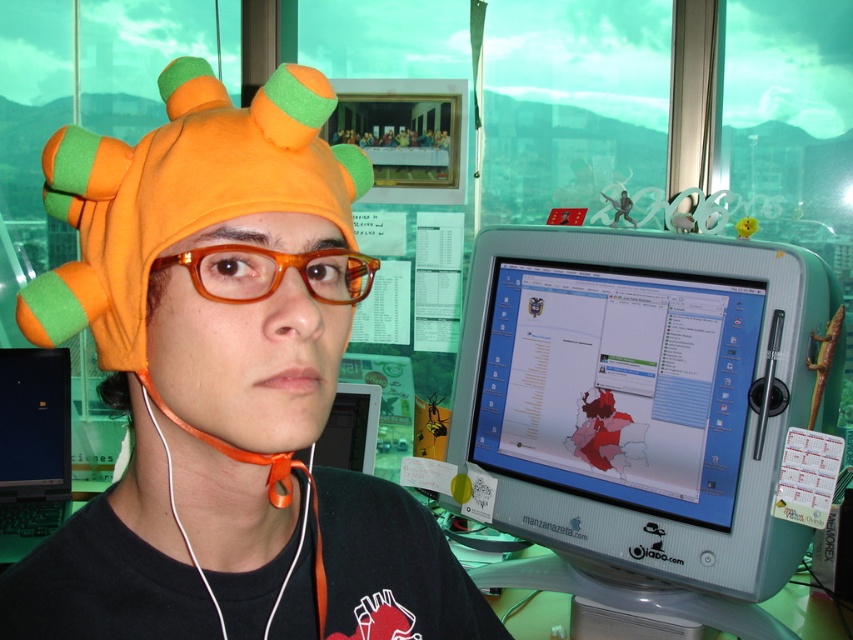
Does orange fleece hat at center have a larger size compared to white earphone at lower left?

Yes.

Does orange fleece hat at center appear on the left side of white earphone at lower left?

Correct, you'll find orange fleece hat at center to the left of white earphone at lower left.

Identify the location of orange fleece hat at center. The width and height of the screenshot is (853, 640). (180, 195).

Which is behind, point (186, 346) or point (100, 144)?

Point (100, 144)

Between orange felt hat at left and orange fleece hat at center, which one has more height?

Standing taller between the two is orange felt hat at left.

Is point (67, 564) closer to camera compared to point (349, 209)?

Yes.

Where is `orange felt hat at left`? This screenshot has width=853, height=640. orange felt hat at left is located at coordinates (225, 387).

Between orange felt hat at left and white earphone at lower left, which one appears on the right side from the viewer's perspective?

white earphone at lower left is more to the right.

Does orange felt hat at left appear on the right side of white earphone at lower left?

In fact, orange felt hat at left is to the left of white earphone at lower left.

Between point (178, 340) and point (254, 456), which one is positioned behind?

Positioned behind is point (254, 456).

The image size is (853, 640). What are the coordinates of `orange felt hat at left` in the screenshot? It's located at (225, 387).